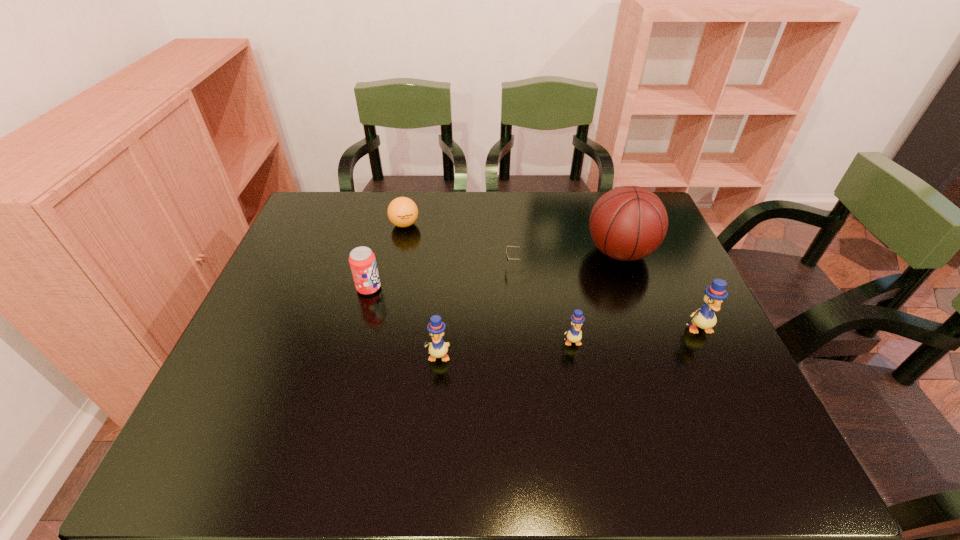
Please point a vacant point for placing a duckling on the left. Please provide its 2D coordinates. Your answer should be formatted as a tuple, i.e. [(x, y)], where the tuple contains the x and y coordinates of a point satisfying the conditions above.

[(296, 372)]